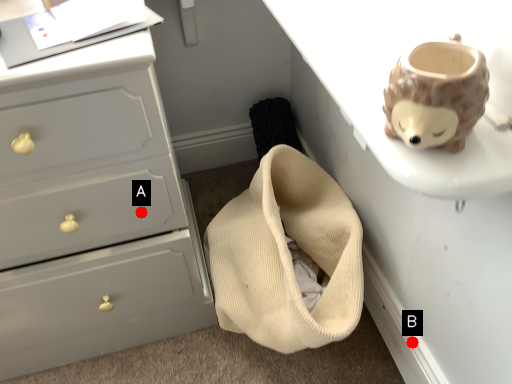
Question: Two points are circled on the image, labeled by A and B beside each circle. Which point is farther to the camera?

Choices:
 (A) A is further
 (B) B is further

Answer: (B)